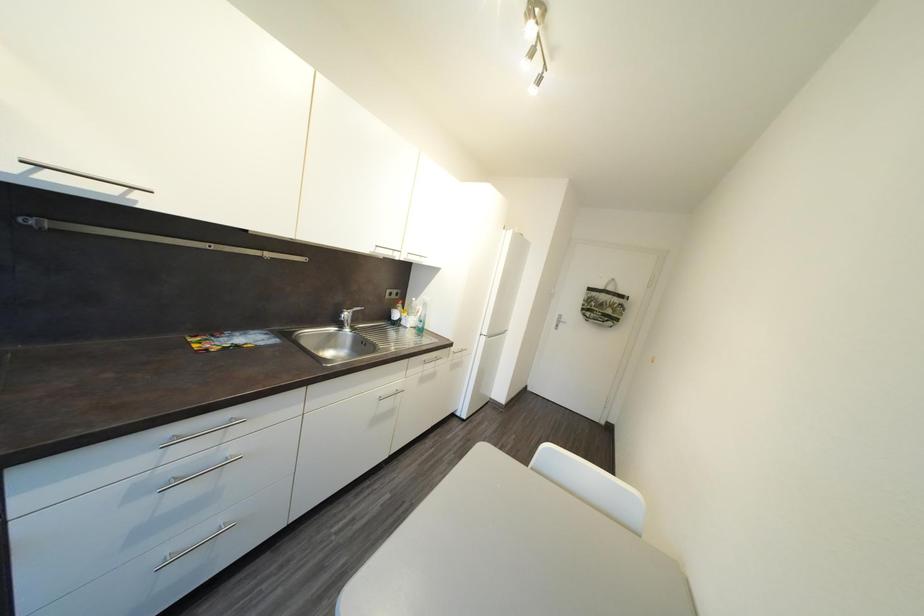
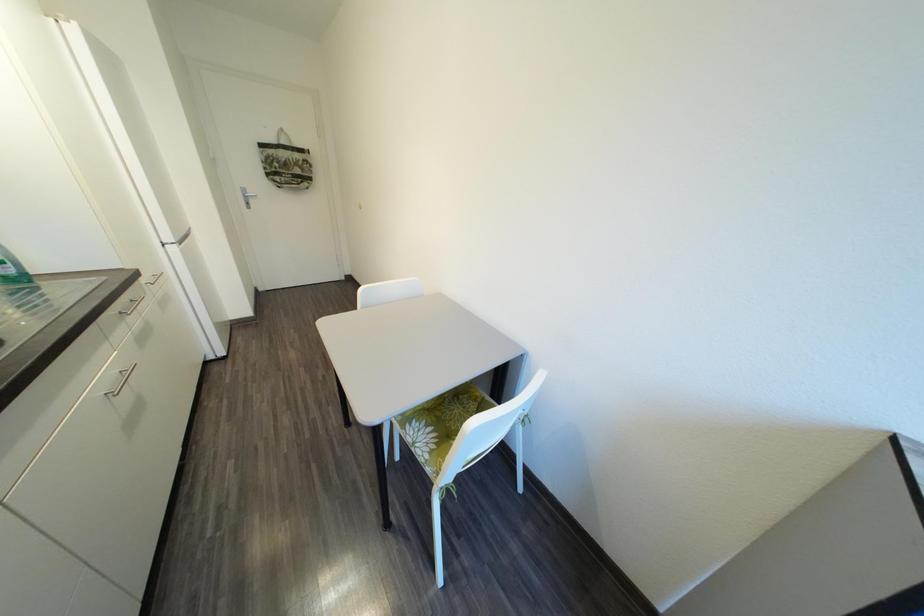
How did the camera likely rotate?

The rotation direction of the camera is right-down.